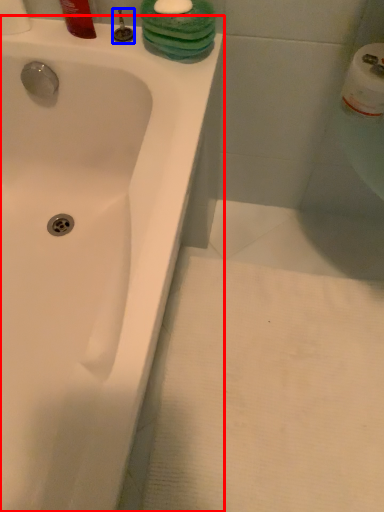
Question: Among these objects, which one is nearest to the camera, bathtub (highlighted by a red box) or plumbing fixture (highlighted by a blue box)?

Choices:
 (A) bathtub
 (B) plumbing fixture

Answer: (A)